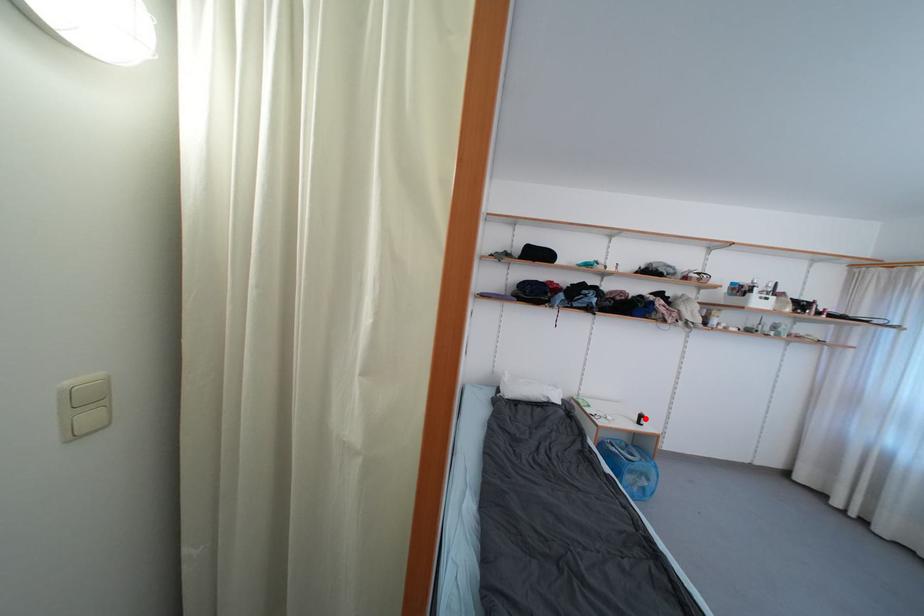
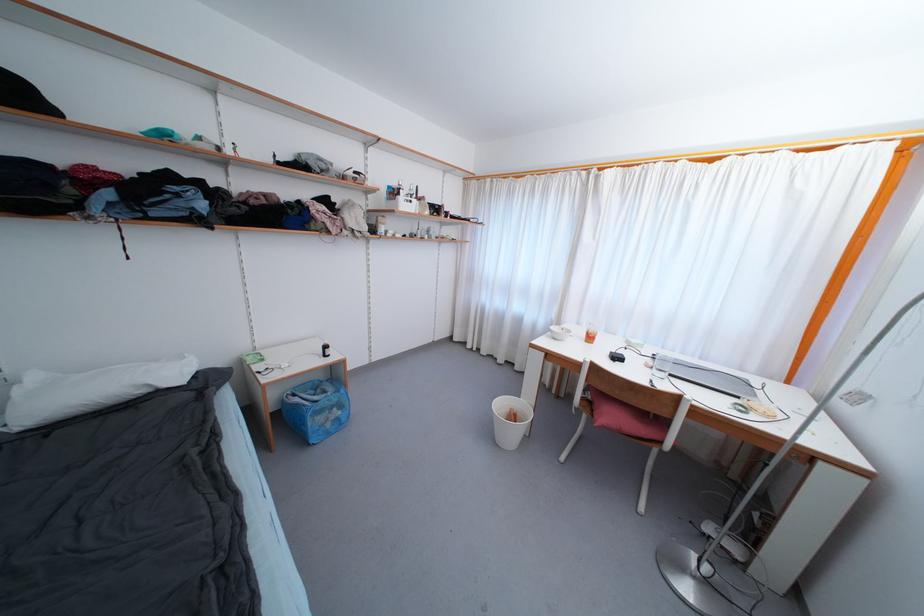
Question: I am providing you with two images of the same scene from different viewpoints. In image1, a red point is highlighted. Considering the same 3D point in image2, which of the following is correct?

Choices:
 (A) It is closer
 (B) It is farther

Answer: (A)